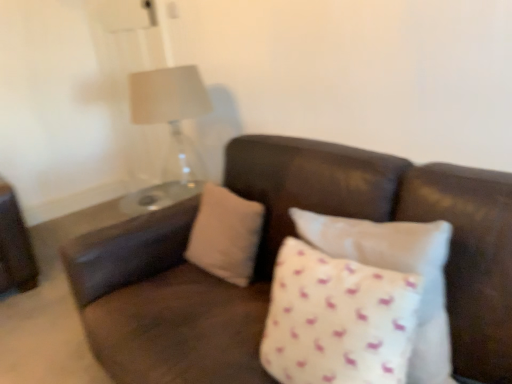
What do you see at coordinates (398, 271) in the screenshot? I see `white dotted pillow at center, the second pillow from the back` at bounding box center [398, 271].

Image resolution: width=512 pixels, height=384 pixels. What are the coordinates of `white dotted pillow at center, the second pillow from the back` in the screenshot? It's located at (398, 271).

This screenshot has width=512, height=384. What do you see at coordinates (226, 235) in the screenshot?
I see `beige fabric pillow at center, which is the first pillow in back-to-front order` at bounding box center [226, 235].

Image resolution: width=512 pixels, height=384 pixels. I want to click on beige fabric pillow at center, which is the first pillow in back-to-front order, so click(x=226, y=235).

Identify the location of white dotted pillow at center, the second pillow from the back. (398, 271).

In the image, is beige fabric pillow at center, which is the first pillow in back-to-front order, on the left side or the right side of white dotted pillow at center, which ranks as the first pillow in front-to-back order?

In the image, beige fabric pillow at center, which is the first pillow in back-to-front order, appears on the left side of white dotted pillow at center, which ranks as the first pillow in front-to-back order.

In the image, is beige fabric pillow at center, acting as the 2th pillow starting from the front, positioned in front of or behind white dotted pillow at center, which ranks as the first pillow in front-to-back order?

beige fabric pillow at center, acting as the 2th pillow starting from the front, is behind white dotted pillow at center, which ranks as the first pillow in front-to-back order.

Does point (256, 252) lie in front of point (448, 231)?

No, (256, 252) is behind (448, 231).

Looking at this image, from the image's perspective, is beige fabric pillow at center, which is the first pillow in back-to-front order, located beneath white dotted pillow at center, the second pillow from the back?

No, from the image's perspective, beige fabric pillow at center, which is the first pillow in back-to-front order, is not beneath white dotted pillow at center, the second pillow from the back.

From a real-world perspective, relative to white dotted pillow at center, which ranks as the first pillow in front-to-back order, is beige fabric pillow at center, acting as the 2th pillow starting from the front, vertically above or below?

In terms of real-world spatial position, beige fabric pillow at center, acting as the 2th pillow starting from the front, is below white dotted pillow at center, which ranks as the first pillow in front-to-back order.

Considering the relative sizes of beige fabric pillow at center, which is the first pillow in back-to-front order, and white dotted pillow at center, the second pillow from the back, in the image provided, is beige fabric pillow at center, which is the first pillow in back-to-front order, thinner than white dotted pillow at center, the second pillow from the back,?

Yes.

Considering the relative sizes of beige fabric pillow at center, acting as the 2th pillow starting from the front, and white dotted pillow at center, which ranks as the first pillow in front-to-back order, in the image provided, is beige fabric pillow at center, acting as the 2th pillow starting from the front, taller than white dotted pillow at center, which ranks as the first pillow in front-to-back order,?

No.

Considering the sizes of beige fabric pillow at center, which is the first pillow in back-to-front order, and white dotted pillow at center, which ranks as the first pillow in front-to-back order, in the image, is beige fabric pillow at center, which is the first pillow in back-to-front order, bigger or smaller than white dotted pillow at center, which ranks as the first pillow in front-to-back order,?

Considering their sizes, beige fabric pillow at center, which is the first pillow in back-to-front order, takes up less space than white dotted pillow at center, which ranks as the first pillow in front-to-back order.

Is beige fabric pillow at center, which is the first pillow in back-to-front order, not inside white dotted pillow at center, which ranks as the first pillow in front-to-back order?

Yes, beige fabric pillow at center, which is the first pillow in back-to-front order, is located beyond the bounds of white dotted pillow at center, which ranks as the first pillow in front-to-back order.

Is beige fabric pillow at center, acting as the 2th pillow starting from the front, not near white dotted pillow at center, the second pillow from the back?

No, beige fabric pillow at center, acting as the 2th pillow starting from the front, is not far away from white dotted pillow at center, the second pillow from the back.

Is beige fabric pillow at center, acting as the 2th pillow starting from the front, aimed at white dotted pillow at center, which ranks as the first pillow in front-to-back order?

No.

Could you measure the distance between beige fabric pillow at center, which is the first pillow in back-to-front order, and white dotted pillow at center, the second pillow from the back?

A distance of 50.46 centimeters exists between beige fabric pillow at center, which is the first pillow in back-to-front order, and white dotted pillow at center, the second pillow from the back.

In the image, there is a white dotted pillow at center, which ranks as the first pillow in front-to-back order. Where is `pillow below it (from a real-world perspective)`? The image size is (512, 384). pillow below it (from a real-world perspective) is located at coordinates (226, 235).

Is white dotted pillow at center, the second pillow from the back, to the right of beige fabric pillow at center, which is the first pillow in back-to-front order, from the viewer's perspective?

Correct, you'll find white dotted pillow at center, the second pillow from the back, to the right of beige fabric pillow at center, which is the first pillow in back-to-front order.

Is white dotted pillow at center, the second pillow from the back, behind beige fabric pillow at center, which is the first pillow in back-to-front order?

No, the depth of white dotted pillow at center, the second pillow from the back, is less than that of beige fabric pillow at center, which is the first pillow in back-to-front order.

Is point (435, 314) closer or farther from the camera than point (219, 205)?

Point (435, 314).

From the image's perspective, is white dotted pillow at center, which ranks as the first pillow in front-to-back order, over beige fabric pillow at center, which is the first pillow in back-to-front order?

No.

Looking at this image, from a real-world perspective, is white dotted pillow at center, which ranks as the first pillow in front-to-back order, positioned above or below beige fabric pillow at center, acting as the 2th pillow starting from the front?

white dotted pillow at center, which ranks as the first pillow in front-to-back order, is situated higher than beige fabric pillow at center, acting as the 2th pillow starting from the front, in the real world.

Considering the sizes of objects white dotted pillow at center, the second pillow from the back, and beige fabric pillow at center, which is the first pillow in back-to-front order, in the image provided, who is thinner, white dotted pillow at center, the second pillow from the back, or beige fabric pillow at center, which is the first pillow in back-to-front order,?

Thinner between the two is beige fabric pillow at center, which is the first pillow in back-to-front order.

Is white dotted pillow at center, the second pillow from the back, taller or shorter than beige fabric pillow at center, which is the first pillow in back-to-front order?

white dotted pillow at center, the second pillow from the back, is taller than beige fabric pillow at center, which is the first pillow in back-to-front order.

In the scene shown: Based on their sizes in the image, would you say white dotted pillow at center, the second pillow from the back, is bigger or smaller than beige fabric pillow at center, acting as the 2th pillow starting from the front?

Considering their sizes, white dotted pillow at center, the second pillow from the back, takes up more space than beige fabric pillow at center, acting as the 2th pillow starting from the front.

Which is correct: white dotted pillow at center, the second pillow from the back, is inside beige fabric pillow at center, acting as the 2th pillow starting from the front, or outside of it?

white dotted pillow at center, the second pillow from the back, lies outside beige fabric pillow at center, acting as the 2th pillow starting from the front.

Would you consider white dotted pillow at center, the second pillow from the back, to be distant from beige fabric pillow at center, which is the first pillow in back-to-front order?

No, white dotted pillow at center, the second pillow from the back, is not far away from beige fabric pillow at center, which is the first pillow in back-to-front order.

Could you tell me if white dotted pillow at center, the second pillow from the back, is turned towards beige fabric pillow at center, which is the first pillow in back-to-front order?

No, white dotted pillow at center, the second pillow from the back, is not facing towards beige fabric pillow at center, which is the first pillow in back-to-front order.

How distant is white dotted pillow at center, the second pillow from the back, from beige fabric pillow at center, which is the first pillow in back-to-front order?

They are 19.87 inches apart.

Identify the location of pillow lying on the right of beige fabric pillow at center, which is the first pillow in back-to-front order. point(398,271).

Locate an element on the screen. Image resolution: width=512 pixels, height=384 pixels. pillow that appears behind the white dotted pillow at center, which ranks as the first pillow in front-to-back order is located at coordinates (226, 235).

You are a GUI agent. You are given a task and a screenshot of the screen. Output one action in this format:
    pyautogui.click(x=<x>, y=<y>)
    Task: Click on the pillow above the white dotted pillow at center, the second pillow from the back (from the image's perspective)
    The image size is (512, 384).
    Given the screenshot: What is the action you would take?
    pyautogui.click(x=226, y=235)